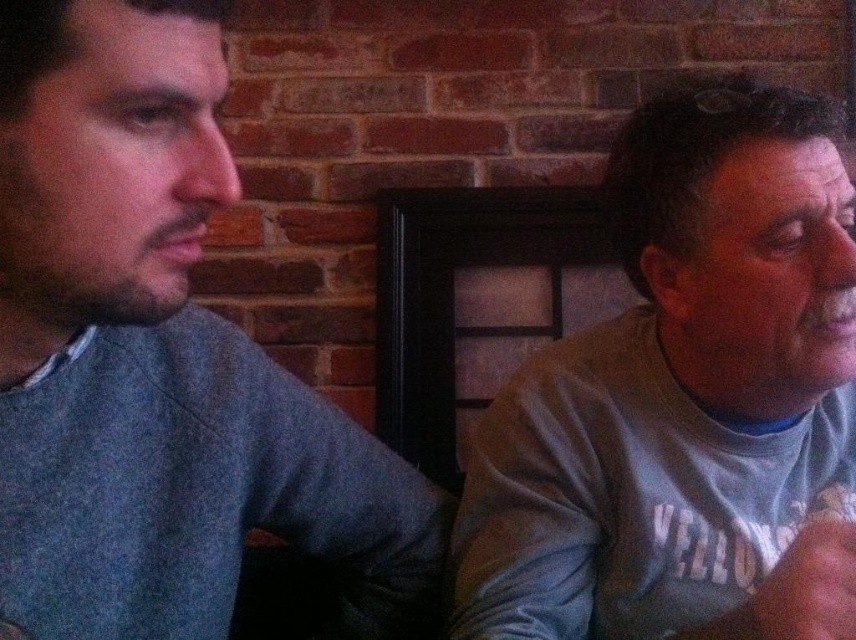
Question: Which point is farther to the camera?

Choices:
 (A) (759, 397)
 (B) (28, 266)

Answer: (A)

Question: In this image, where is gray cotton shirt at left located relative to gray cotton shirt at right?

Choices:
 (A) below
 (B) above

Answer: (A)

Question: Among these objects, which one is nearest to the camera?

Choices:
 (A) gray cotton shirt at left
 (B) gray cotton shirt at right

Answer: (A)

Question: Does gray cotton shirt at left appear on the left side of gray cotton shirt at right?

Choices:
 (A) yes
 (B) no

Answer: (A)

Question: Is the position of gray cotton shirt at left more distant than that of gray cotton shirt at right?

Choices:
 (A) no
 (B) yes

Answer: (A)

Question: Which object is farther from the camera taking this photo?

Choices:
 (A) gray cotton shirt at right
 (B) gray cotton shirt at left

Answer: (A)